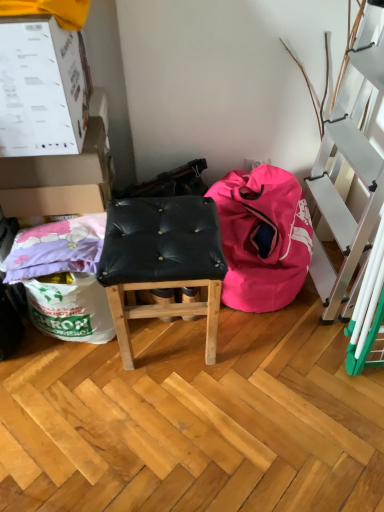
Question: Is white cardboard box at upper left, placed as the first box when sorted from front to back, shorter than white cardboard box at upper left, the 1th box from the back?

Choices:
 (A) no
 (B) yes

Answer: (A)

Question: From the image's perspective, would you say white cardboard box at upper left, the 2th box when ordered from back to front, is positioned over white cardboard box at upper left, the 2th box viewed from the front?

Choices:
 (A) no
 (B) yes

Answer: (B)

Question: Is white cardboard box at upper left, the 2th box when ordered from back to front, positioned beyond the bounds of white cardboard box at upper left, the 2th box viewed from the front?

Choices:
 (A) no
 (B) yes

Answer: (B)

Question: Would you say white cardboard box at upper left, the 1th box from the back, is part of white cardboard box at upper left, placed as the first box when sorted from front to back,'s contents?

Choices:
 (A) no
 (B) yes

Answer: (A)

Question: Can you confirm if white cardboard box at upper left, the 2th box when ordered from back to front, is smaller than white cardboard box at upper left, the 1th box from the back?

Choices:
 (A) yes
 (B) no

Answer: (B)

Question: In the image, is white cardboard box at upper left, placed as the first box when sorted from front to back, positioned in front of or behind pink fabric bean bag at lower right?

Choices:
 (A) behind
 (B) front

Answer: (B)

Question: From their relative heights in the image, would you say white cardboard box at upper left, the 2th box when ordered from back to front, is taller or shorter than pink fabric bean bag at lower right?

Choices:
 (A) tall
 (B) short

Answer: (B)

Question: In terms of width, does white cardboard box at upper left, the 2th box when ordered from back to front, look wider or thinner when compared to pink fabric bean bag at lower right?

Choices:
 (A) wide
 (B) thin

Answer: (B)

Question: From the image's perspective, is white cardboard box at upper left, placed as the first box when sorted from front to back, located above or below pink fabric bean bag at lower right?

Choices:
 (A) below
 (B) above

Answer: (B)

Question: In terms of size, does black leather stool at center appear bigger or smaller than white cardboard box at upper left, placed as the first box when sorted from front to back?

Choices:
 (A) small
 (B) big

Answer: (B)

Question: Is black leather stool at center in front of or behind white cardboard box at upper left, placed as the first box when sorted from front to back, in the image?

Choices:
 (A) behind
 (B) front

Answer: (A)

Question: From a real-world perspective, relative to white cardboard box at upper left, placed as the first box when sorted from front to back, is black leather stool at center vertically above or below?

Choices:
 (A) above
 (B) below

Answer: (B)

Question: Considering the positions of black leather stool at center and white cardboard box at upper left, placed as the first box when sorted from front to back, in the image, is black leather stool at center taller or shorter than white cardboard box at upper left, placed as the first box when sorted from front to back,?

Choices:
 (A) short
 (B) tall

Answer: (B)

Question: Considering their positions, is white cardboard box at upper left, placed as the first box when sorted from front to back, located in front of or behind black leather stool at center?

Choices:
 (A) front
 (B) behind

Answer: (A)

Question: From a real-world perspective, is white cardboard box at upper left, placed as the first box when sorted from front to back, above or below black leather stool at center?

Choices:
 (A) above
 (B) below

Answer: (A)